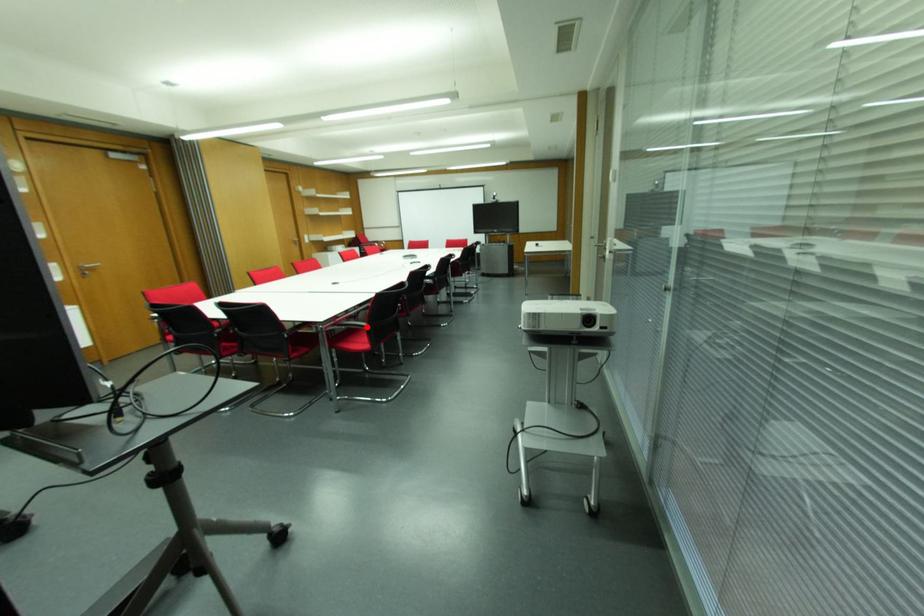
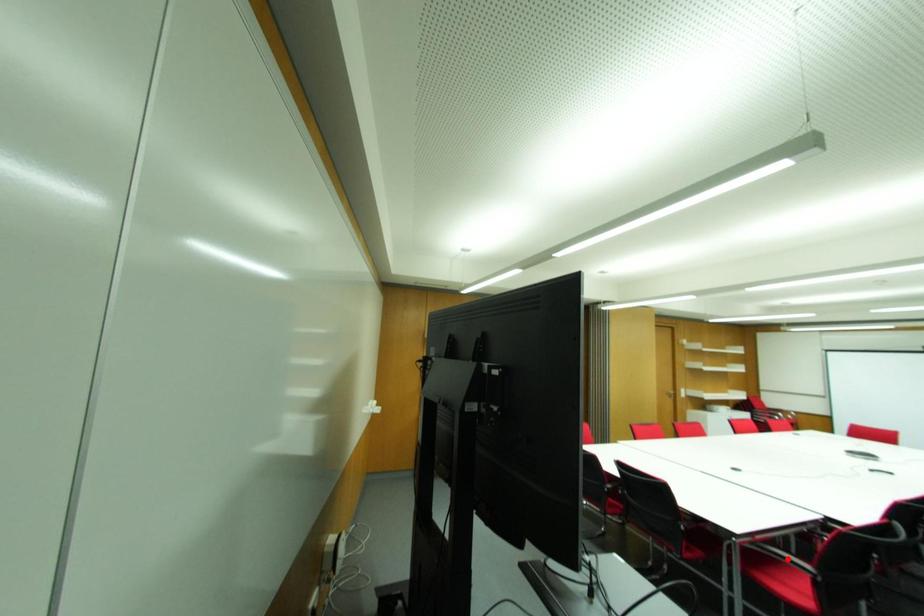
I am providing you with two images of the same scene from different viewpoints. A red point is marked on the first image and another point is marked on the second image. Does the point marked in image1 correspond to the same location as the one in image2?

No